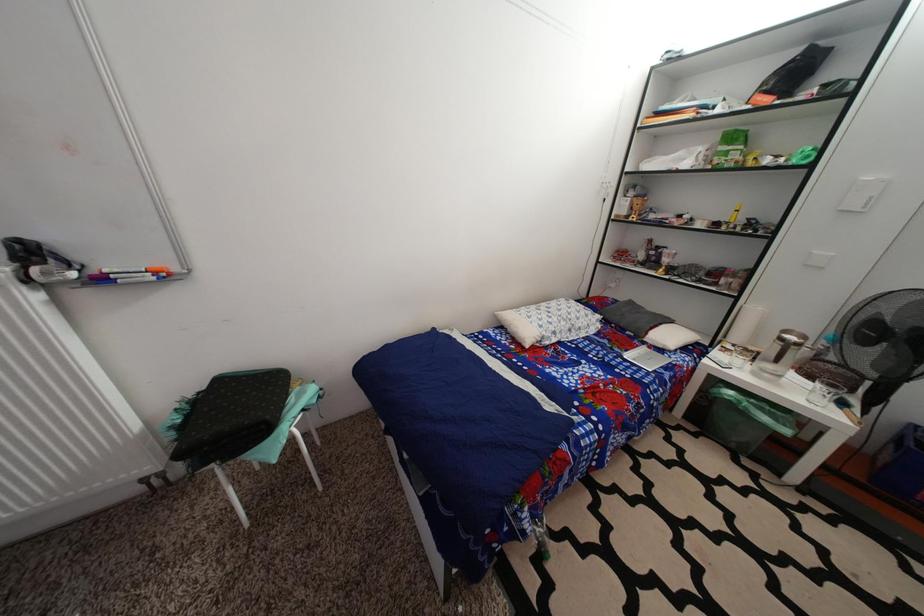
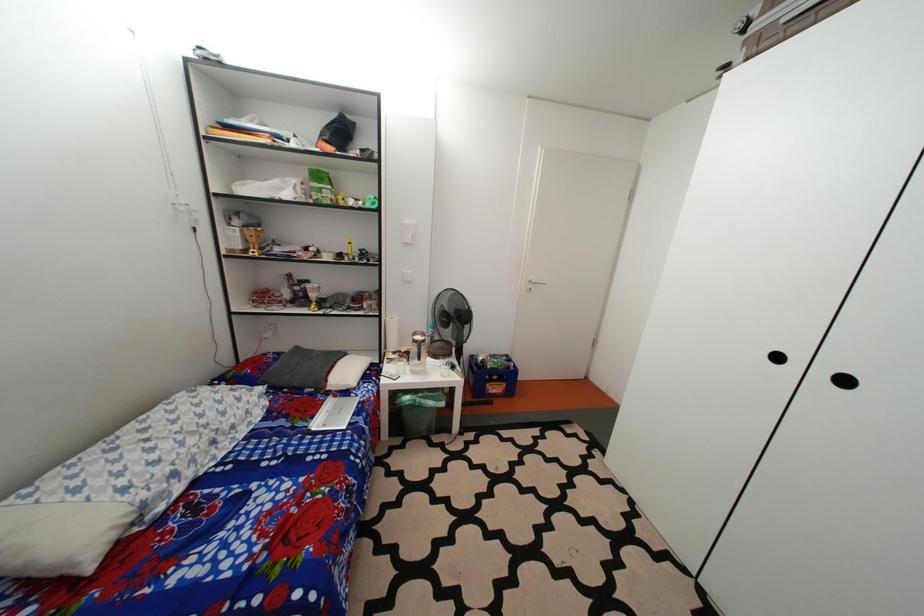
Question: The camera is either moving clockwise (left) or counter-clockwise (right) around the object. The first image is from the beginning of the video and the second image is from the end. Is the camera moving left or right when shooting the video?

Choices:
 (A) Left
 (B) Right

Answer: (A)